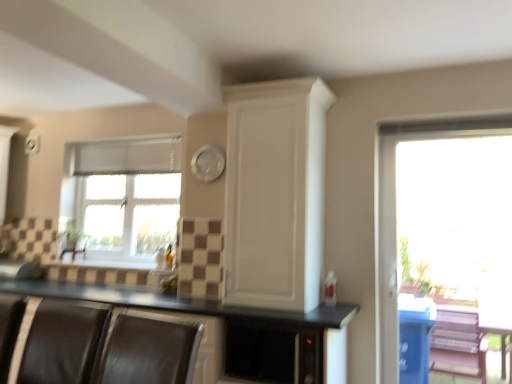
Question: Is white matte cabinet at upper center smaller than white fabric blind at upper left?

Choices:
 (A) no
 (B) yes

Answer: (A)

Question: Considering the relative positions of white matte cabinet at upper center and white fabric blind at upper left in the image provided, is white matte cabinet at upper center to the left of white fabric blind at upper left from the viewer's perspective?

Choices:
 (A) yes
 (B) no

Answer: (B)

Question: Does white matte cabinet at upper center turn towards white fabric blind at upper left?

Choices:
 (A) yes
 (B) no

Answer: (B)

Question: Can you confirm if white matte cabinet at upper center is positioned to the right of white fabric blind at upper left?

Choices:
 (A) yes
 (B) no

Answer: (A)

Question: Can you confirm if white matte cabinet at upper center is shorter than white fabric blind at upper left?

Choices:
 (A) yes
 (B) no

Answer: (B)

Question: Is white fabric blind at upper left spatially inside white matte cabinet at upper center, or outside of it?

Choices:
 (A) inside
 (B) outside

Answer: (B)

Question: From a real-world perspective, is white fabric blind at upper left physically located above or below white matte cabinet at upper center?

Choices:
 (A) below
 (B) above

Answer: (B)

Question: From the image's perspective, is white fabric blind at upper left positioned above or below white matte cabinet at upper center?

Choices:
 (A) below
 (B) above

Answer: (B)

Question: Looking at the image, does white fabric blind at upper left seem bigger or smaller compared to white matte cabinet at upper center?

Choices:
 (A) big
 (B) small

Answer: (B)

Question: Is transparent glass window at right, the 2th window when ordered from left to right, to the left or to the right of black matte countertop at center in the image?

Choices:
 (A) right
 (B) left

Answer: (A)

Question: From a real-world perspective, is transparent glass window at right, the 1th window from the right, physically located above or below black matte countertop at center?

Choices:
 (A) above
 (B) below

Answer: (A)

Question: In terms of height, does transparent glass window at right, which appears as the 2th window when viewed from the back, look taller or shorter compared to black matte countertop at center?

Choices:
 (A) tall
 (B) short

Answer: (A)

Question: From the image's perspective, is transparent glass window at right, which appears as the 2th window when viewed from the back, positioned above or below black matte countertop at center?

Choices:
 (A) below
 (B) above

Answer: (B)

Question: Would you say black matte countertop at center is to the left or to the right of transparent glass window at right, which appears as the 2th window when viewed from the back, in the picture?

Choices:
 (A) right
 (B) left

Answer: (B)

Question: Does point (298, 317) appear closer or farther from the camera than point (509, 195)?

Choices:
 (A) farther
 (B) closer

Answer: (B)